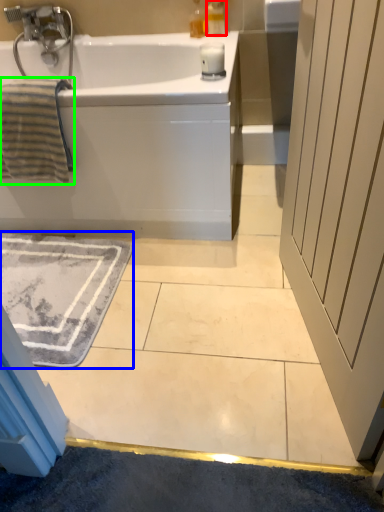
Question: Based on their relative distances, which object is farther from soap dispenser (highlighted by a red box)? Choose from bath mat (highlighted by a blue box) and bath towel (highlighted by a green box).

Choices:
 (A) bath mat
 (B) bath towel

Answer: (A)